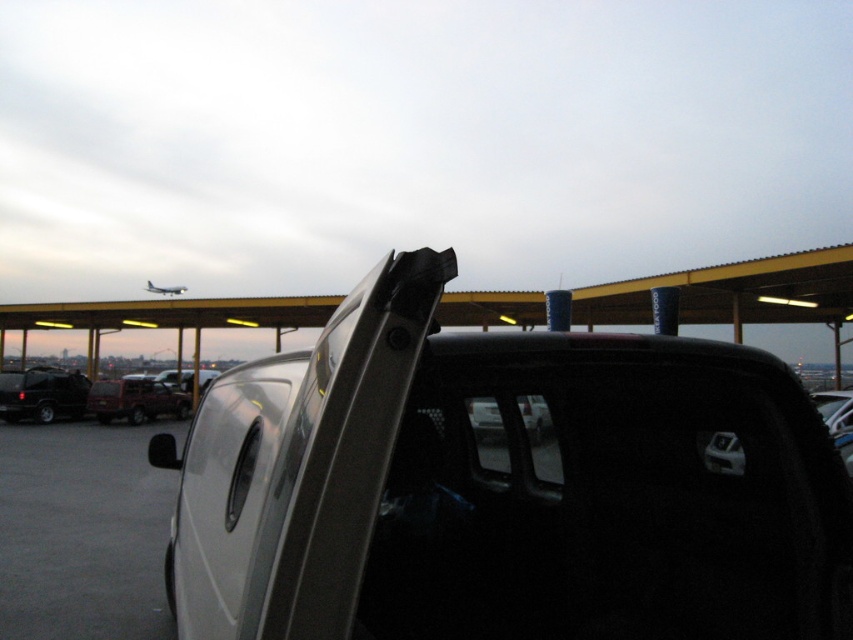
How far apart are satin silver pickup at center and matte red pickup truck at center?

satin silver pickup at center and matte red pickup truck at center are 18.76 meters apart from each other.

Locate an element on the screen. satin silver pickup at center is located at coordinates (503, 486).

Locate an element on the screen. Image resolution: width=853 pixels, height=640 pixels. satin silver pickup at center is located at coordinates (503, 486).

Who is positioned more to the right, satin silver pickup at center or matte black car door at center?

satin silver pickup at center

Between point (544, 476) and point (477, 422), which one is positioned in front?

Point (477, 422) is more forward.

Who is more distant from viewer, (292,554) or (485,396)?

Positioned behind is point (485,396).

The image size is (853, 640). I want to click on satin silver pickup at center, so [x=503, y=486].

Between matte red pickup truck at center and matte black car door at center, which one is positioned higher?

matte black car door at center

Who is more distant from viewer, (x=183, y=408) or (x=488, y=403)?

Point (x=183, y=408)

Who is more distant from viewer, (93, 400) or (485, 420)?

Positioned behind is point (93, 400).

The image size is (853, 640). Find the location of `matte red pickup truck at center`. matte red pickup truck at center is located at coordinates (135, 401).